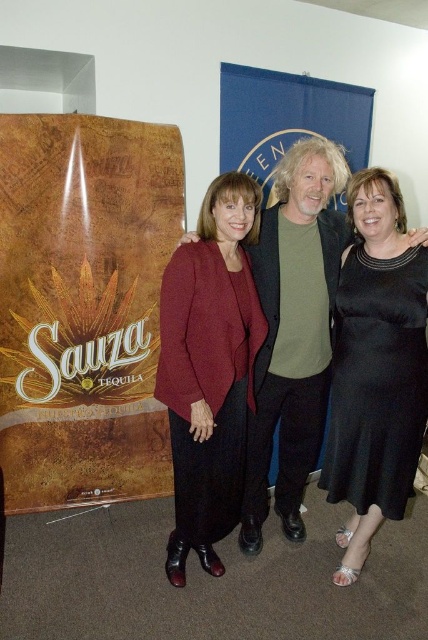
Question: Does maroon woolen cardigan at center appear on the right side of black satin dress at center?

Choices:
 (A) no
 (B) yes

Answer: (A)

Question: Estimate the real-world distances between objects in this image. Which object is closer to the maroon woolen cardigan at center?

Choices:
 (A) black satin dress at center
 (B) brown wood grain poster at left
 (C) matte black dress at center

Answer: (C)

Question: Considering the real-world distances, which object is closest to the black satin dress at center?

Choices:
 (A) brown wood grain poster at left
 (B) matte black dress at center
 (C) maroon woolen cardigan at center

Answer: (B)

Question: Which point is farther from the camera taking this photo?

Choices:
 (A) (116, 128)
 (B) (338, 532)
 (C) (240, 460)

Answer: (B)

Question: Can you confirm if brown wood grain poster at left is positioned above black satin dress at center?

Choices:
 (A) no
 (B) yes

Answer: (B)

Question: Considering the relative positions of brown wood grain poster at left and maroon woolen cardigan at center in the image provided, where is brown wood grain poster at left located with respect to maroon woolen cardigan at center?

Choices:
 (A) right
 (B) left

Answer: (B)